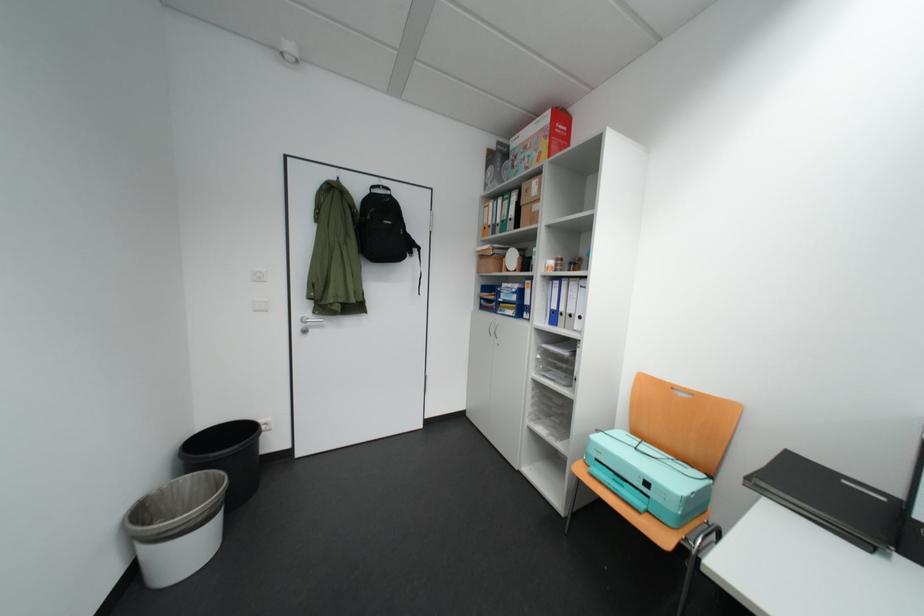
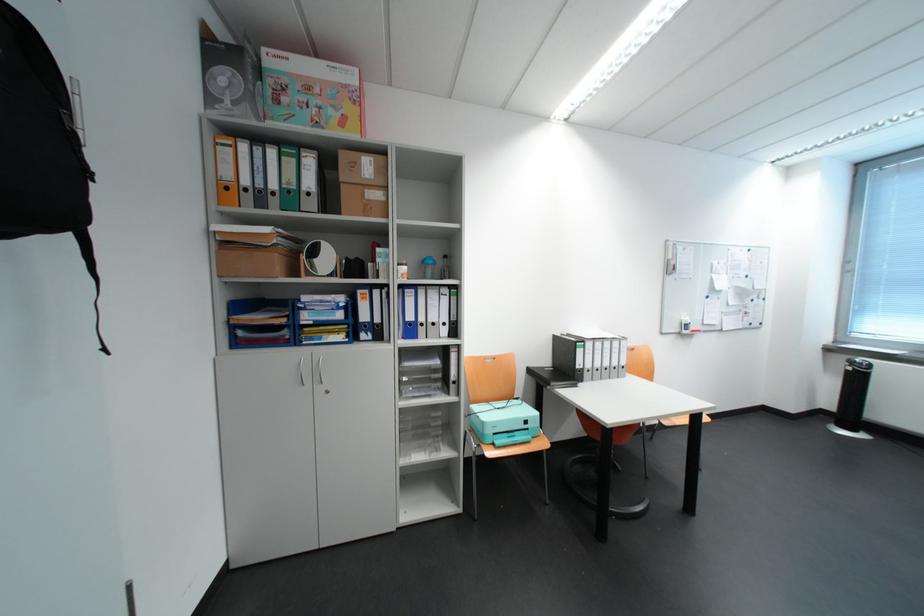
In the second image, find the point that corresponds to point 496,187 in the first image.

(223, 99)